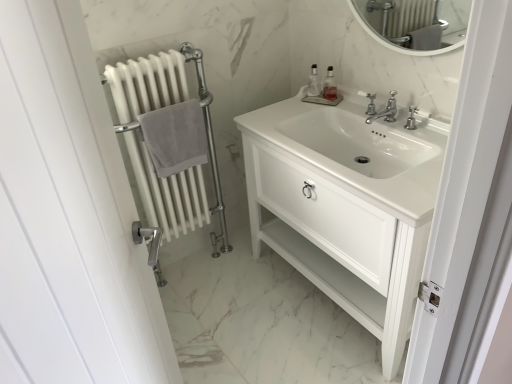
Question: Is white glossy sink at center at the left side of translucent plastic soap dispenser at upper center, the 2th soap dispenser in the left-to-right sequence?

Choices:
 (A) yes
 (B) no

Answer: (B)

Question: From the image's perspective, would you say white glossy sink at center is shown under translucent plastic soap dispenser at upper center, the 2th soap dispenser in the left-to-right sequence?

Choices:
 (A) no
 (B) yes

Answer: (B)

Question: Is white glossy sink at center closer to the viewer compared to translucent plastic soap dispenser at upper center, the 2th soap dispenser in the left-to-right sequence?

Choices:
 (A) yes
 (B) no

Answer: (A)

Question: From the image's perspective, is white glossy sink at center located above translucent plastic soap dispenser at upper center, the 2th soap dispenser in the left-to-right sequence?

Choices:
 (A) yes
 (B) no

Answer: (B)

Question: Is white glossy sink at center to the right of translucent plastic soap dispenser at upper center, the 2th soap dispenser in the left-to-right sequence, from the viewer's perspective?

Choices:
 (A) no
 (B) yes

Answer: (B)

Question: From the image's perspective, is white matte radiator at left positioned above or below clear plastic soap dispenser at upper right, which is counted as the second soap dispenser, starting from the right?

Choices:
 (A) below
 (B) above

Answer: (A)

Question: Looking at their shapes, would you say white matte radiator at left is wider or thinner than clear plastic soap dispenser at upper right, which is counted as the second soap dispenser, starting from the right?

Choices:
 (A) thin
 (B) wide

Answer: (B)

Question: Is white matte radiator at left taller or shorter than clear plastic soap dispenser at upper right, which is counted as the second soap dispenser, starting from the right?

Choices:
 (A) tall
 (B) short

Answer: (A)

Question: Considering their positions, is white matte radiator at left located in front of or behind clear plastic soap dispenser at upper right, marked as the first soap dispenser in a left-to-right arrangement?

Choices:
 (A) front
 (B) behind

Answer: (A)

Question: From a real-world perspective, relative to silver metallic faucet at center, is gray cotton towel at left vertically above or below?

Choices:
 (A) above
 (B) below

Answer: (B)

Question: In the image, is gray cotton towel at left on the left side or the right side of silver metallic faucet at center?

Choices:
 (A) right
 (B) left

Answer: (B)

Question: Is gray cotton towel at left taller or shorter than silver metallic faucet at center?

Choices:
 (A) tall
 (B) short

Answer: (A)

Question: Considering the positions of gray cotton towel at left and silver metallic faucet at center in the image, is gray cotton towel at left wider or thinner than silver metallic faucet at center?

Choices:
 (A) thin
 (B) wide

Answer: (A)

Question: In terms of size, does white matte radiator at left appear bigger or smaller than white glossy sink at center?

Choices:
 (A) big
 (B) small

Answer: (A)

Question: Is point (202, 91) positioned closer to the camera than point (328, 170)?

Choices:
 (A) farther
 (B) closer

Answer: (A)